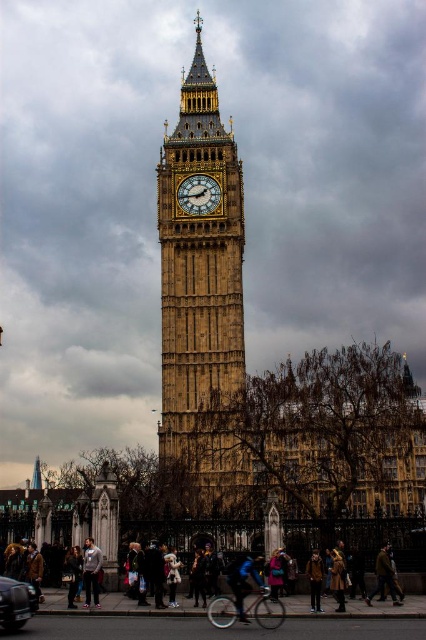
You are a tourist standing at the base of Big Ben and want to take a photo that includes both the iconic clock face and the shiny black car at lower left. Considering the distance between you and the car, is it possible to capture both in a single frame without moving your position?

The shiny black car at lower left is 87.35 meters away from the camera. Since the car is quite far from the base of Big Ben, it might be challenging to include both the clock face and the car in one frame without moving, as the distance between them is substantial.

You are a tour guide leading a group near the Elizabeth Tower. You want to point out the shiny black car at lower left and the gold textured clock at center. If the car is 46.96 meters away from the clock, can you estimate whether the car is within a 50 meter radius from the clock?

The shiny black car at lower left is 46.96 meters from the gold textured clock at center, so yes, it is within a 50 meter radius.